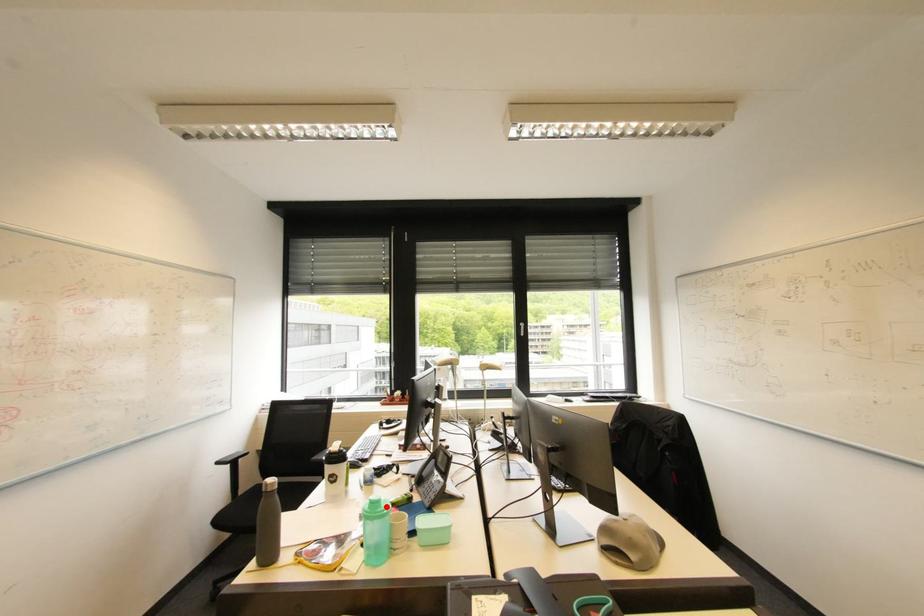
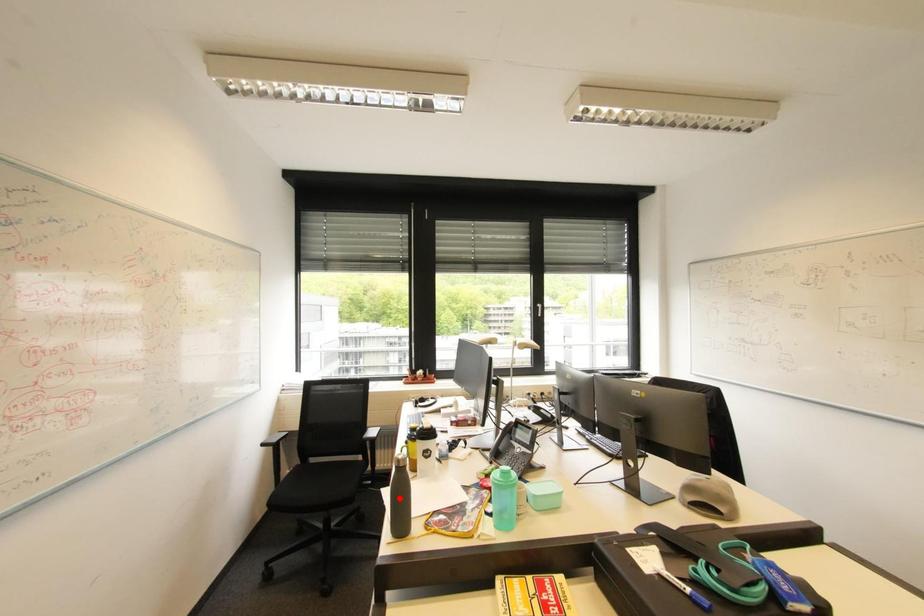
I am providing you with two images of the same scene from different viewpoints. A red point is marked on the first image and another point is marked on the second image. Is the red point in image1 aligned with the point shown in image2?

No